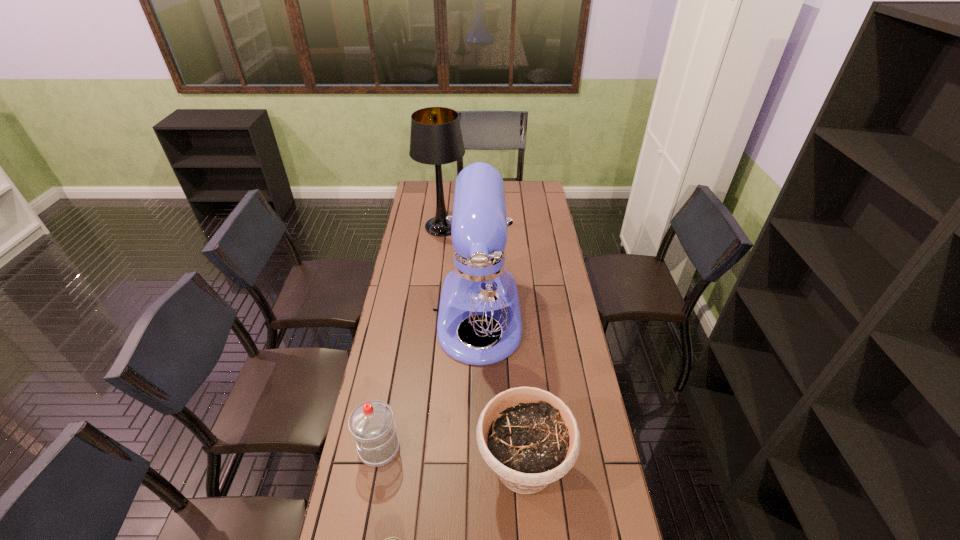
Locate an element on the screen. Image resolution: width=960 pixels, height=540 pixels. vacant area that satisfies the following two spatial constraints: 1. on the handle side of the water bottle; 2. on the left side of the flowerpot is located at coordinates (375, 469).